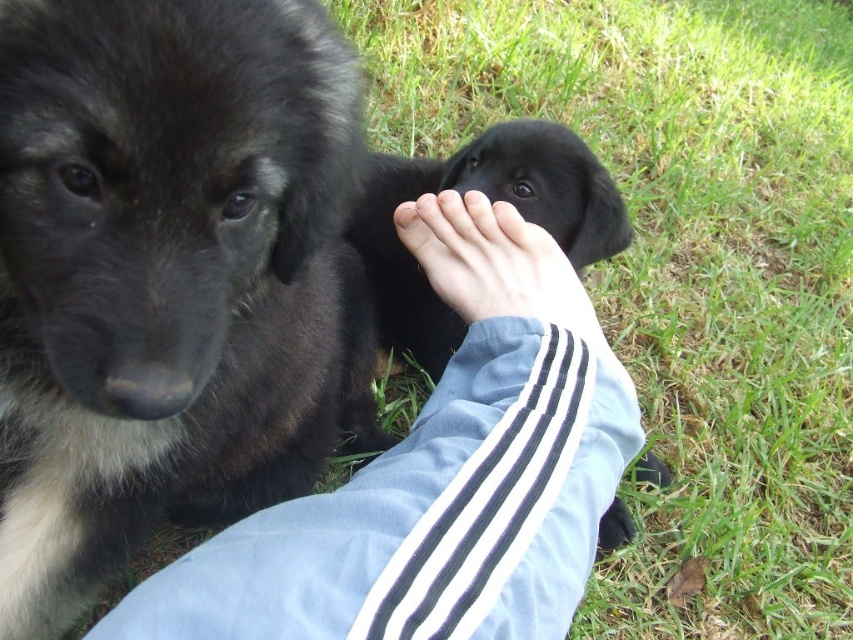
You are standing at the origin point in the image. You need to reach the point labeled as point (599, 248). However, there is an obstacle at point (462, 300). Can you walk directly to your destination without going around the obstacle?

The point (462, 300) is in front of point (599, 248). Therefore, walking directly to point (599, 248) would require passing through the obstacle at point (462, 300), so you cannot go directly and must go around.

You are a photographer trying to capture the interaction between the black fur dog at center and the skinny white hand at center. Which object is located to the right of the other?

The skinny white hand at center is located to the right of the black fur dog at center because the black fur dog at center is positioned on the left side of the skinny white hand at center.

You are a dog trainer observing the interaction between the person and the puppies. Based on the image, which object is larger in size between the skinny white hand at center and the black fur paw at lower center?

The skinny white hand at center is bigger than the black fur paw at lower center.